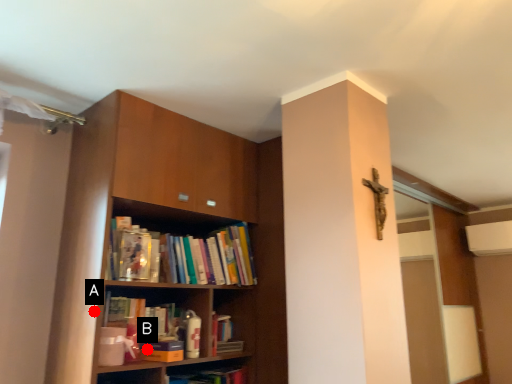
Question: Two points are circled on the image, labeled by A and B beside each circle. Which of the following is the closest to the observer?

Choices:
 (A) A is closer
 (B) B is closer

Answer: (A)